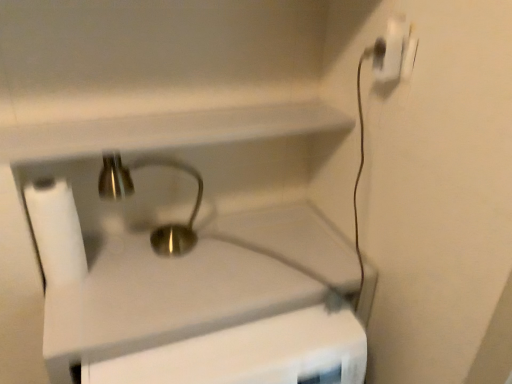
Question: Is white plastic power plug at upper right taller than polished brass faucet at center?

Choices:
 (A) yes
 (B) no

Answer: (B)

Question: Would you say white plastic power plug at upper right is a long distance from polished brass faucet at center?

Choices:
 (A) no
 (B) yes

Answer: (A)

Question: From a real-world perspective, is white plastic power plug at upper right located beneath polished brass faucet at center?

Choices:
 (A) no
 (B) yes

Answer: (A)

Question: From the image's perspective, is white plastic power plug at upper right on top of polished brass faucet at center?

Choices:
 (A) no
 (B) yes

Answer: (B)

Question: Considering the relative positions of white plastic power plug at upper right and polished brass faucet at center in the image provided, is white plastic power plug at upper right to the right of polished brass faucet at center from the viewer's perspective?

Choices:
 (A) no
 (B) yes

Answer: (B)

Question: Is the depth of white plastic power plug at upper right greater than that of polished brass faucet at center?

Choices:
 (A) yes
 (B) no

Answer: (B)

Question: Is white matte toilet paper at left far from polished brass faucet at center?

Choices:
 (A) yes
 (B) no

Answer: (B)

Question: Does white matte toilet paper at left appear on the left side of polished brass faucet at center?

Choices:
 (A) yes
 (B) no

Answer: (A)

Question: Is polished brass faucet at center at the back of white matte toilet paper at left?

Choices:
 (A) no
 (B) yes

Answer: (A)

Question: From the image's perspective, does white matte toilet paper at left appear higher than polished brass faucet at center?

Choices:
 (A) yes
 (B) no

Answer: (B)

Question: From a real-world perspective, is white matte toilet paper at left located beneath polished brass faucet at center?

Choices:
 (A) yes
 (B) no

Answer: (A)

Question: Is white matte toilet paper at left bigger than polished brass faucet at center?

Choices:
 (A) no
 (B) yes

Answer: (A)

Question: Can you confirm if white matte toilet paper at left is bigger than brass metallic sink at center?

Choices:
 (A) no
 (B) yes

Answer: (A)